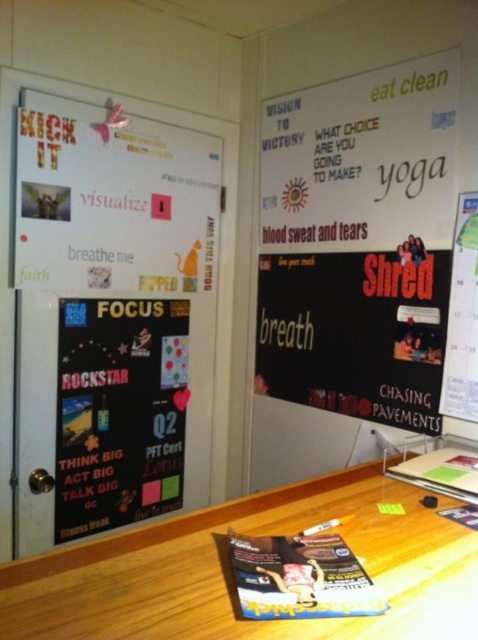
Question: Can you confirm if matte black poster at center is positioned above matte black poster at upper right?

Choices:
 (A) no
 (B) yes

Answer: (A)

Question: In this image, where is white matte bulletin board at upper right located relative to wooden table at lower center?

Choices:
 (A) below
 (B) above

Answer: (B)

Question: Which point is closer to the camera?

Choices:
 (A) white matte bulletin board at upper right
 (B) matte black poster at upper right

Answer: (B)

Question: Can you confirm if wooden table at lower center is bigger than matte black poster at center?

Choices:
 (A) no
 (B) yes

Answer: (A)

Question: Which of the following is the farthest from the observer?

Choices:
 (A) click(449, 76)
 (B) click(474, 342)
 (C) click(388, 572)
 (D) click(118, 314)

Answer: (D)

Question: Considering the real-world distances, which object is farthest from the white matte bulletin board at upper right?

Choices:
 (A) matte black poster at center
 (B) wooden table at lower center
 (C) matte black poster at upper right

Answer: (B)